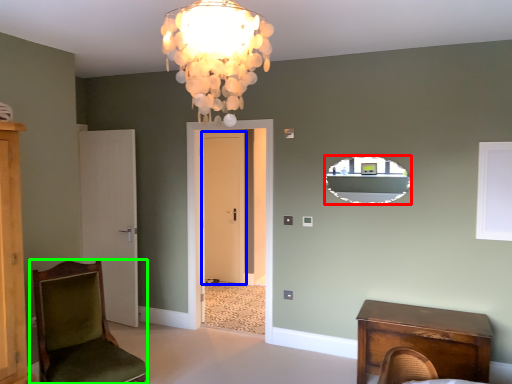
Question: Based on their relative distances, which object is nearer to mirror (highlighted by a red box)? Choose from door (highlighted by a blue box) and chair (highlighted by a green box).

Choices:
 (A) door
 (B) chair

Answer: (B)